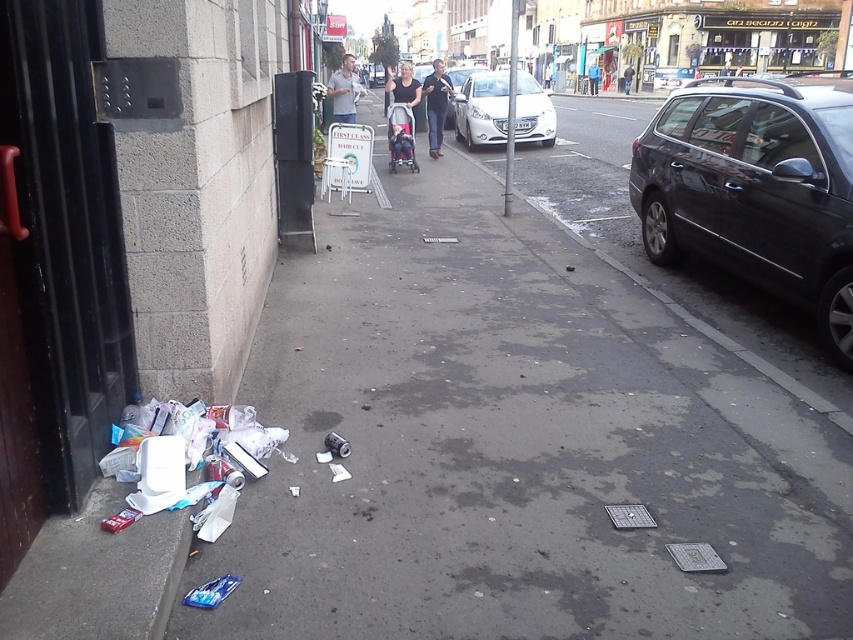
You are a pedestrian trying to cross the sidewalk. You see the white paper at left and the white glossy sedan at center. Which object is closer to the left edge of the sidewalk?

The white paper at left is closer to the left edge of the sidewalk because it is positioned to the left of the white glossy sedan at center.

You are a city planner analyzing the urban street scene. You notice the white paper at left and the black glossy car at right. Which object has a greater width according to the scene?

The white paper at left has a greater width than the black glossy car at right.